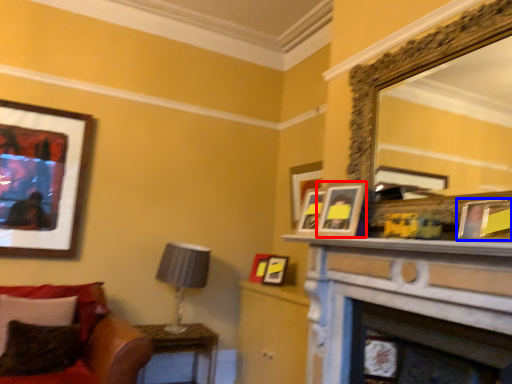
Question: Which object appears closest to the camera in this image, picture frame (highlighted by a red box) or picture frame (highlighted by a blue box)?

Choices:
 (A) picture frame
 (B) picture frame

Answer: (B)